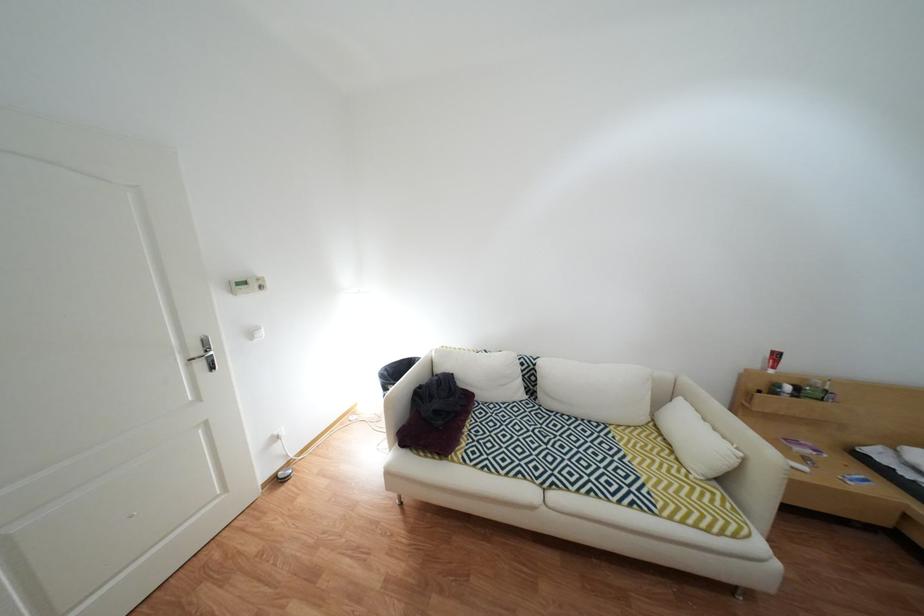
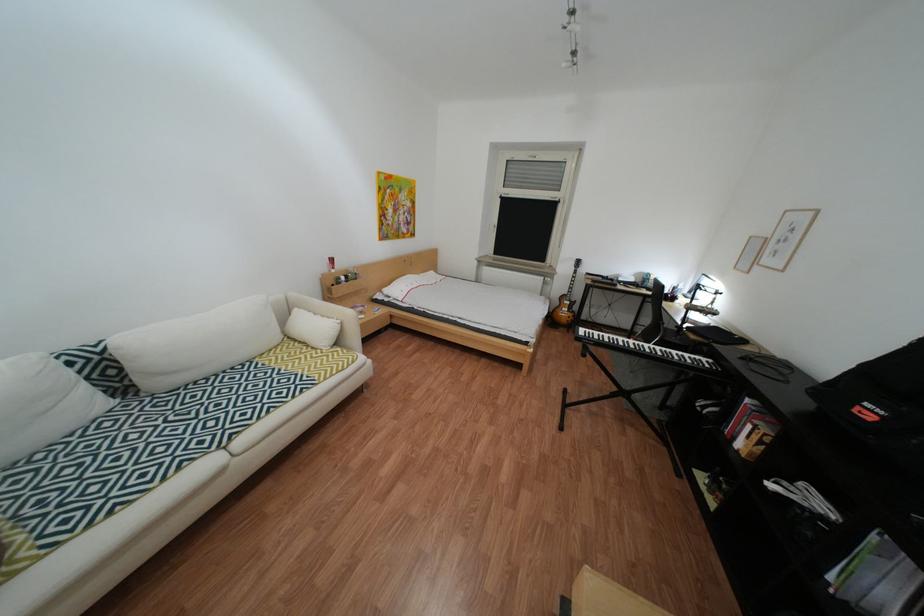
The point at (760, 461) is marked in the first image. Where is the corresponding point in the second image?

(358, 323)